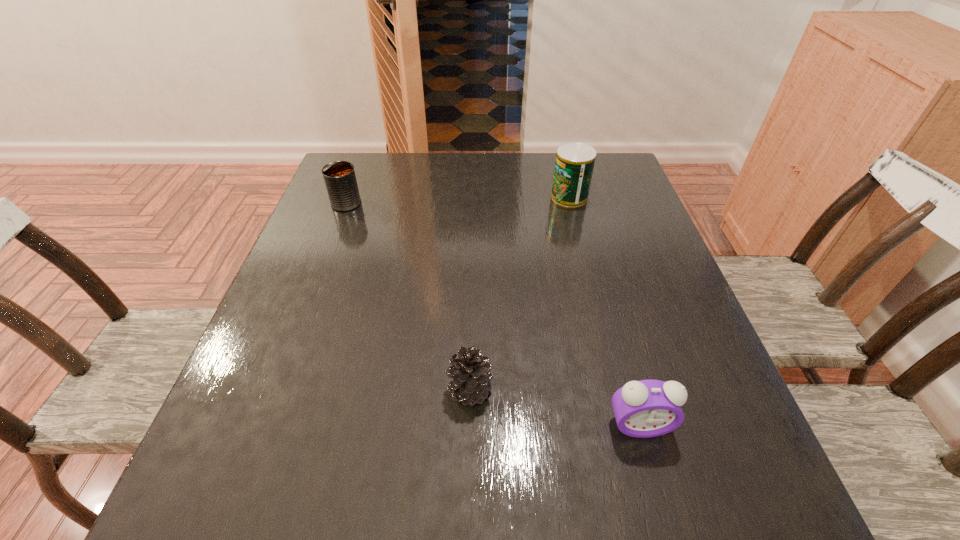
At what (x,y) coordinates should I click in order to perform the action: click on the right can. Please return your answer as a coordinate pair (x, y). The width and height of the screenshot is (960, 540). Looking at the image, I should click on (574, 164).

Find the location of a particular element. The width and height of the screenshot is (960, 540). the left can is located at coordinates (339, 176).

Locate an element on the screen. Image resolution: width=960 pixels, height=540 pixels. alarm clock is located at coordinates (648, 408).

Locate an element on the screen. Image resolution: width=960 pixels, height=540 pixels. the third farthest object is located at coordinates (471, 374).

At what (x,y) coordinates should I click in order to perform the action: click on the second object from left to right. Please return your answer as a coordinate pair (x, y). Image resolution: width=960 pixels, height=540 pixels. Looking at the image, I should click on (471, 374).

Where is `free location located on the left of the right can`? This screenshot has width=960, height=540. free location located on the left of the right can is located at coordinates (419, 197).

Identify the location of vacant space located on the back of the left can. (361, 164).

This screenshot has width=960, height=540. In order to click on free point located 0.110m on the face of the nearest object in this screenshot , I will do `click(663, 512)`.

This screenshot has width=960, height=540. Find the location of `free spot located on the front of the third object from right to left`. free spot located on the front of the third object from right to left is located at coordinates (468, 464).

What are the coordinates of `object located at the left edge` in the screenshot? It's located at (339, 176).